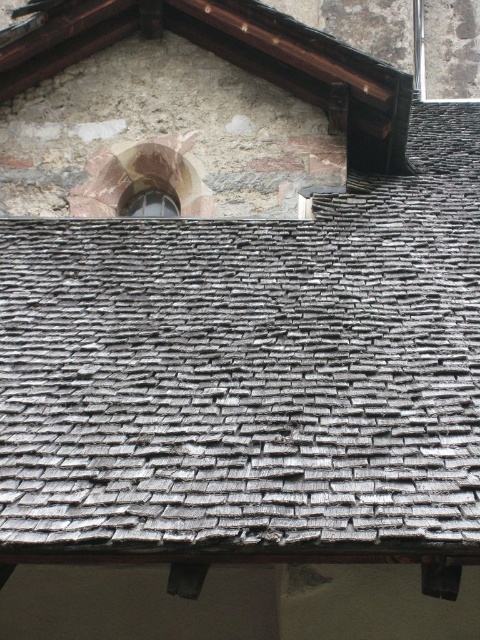
How far apart are weathered wood shingles at upper center and matte glass window at upper center?

The distance of weathered wood shingles at upper center from matte glass window at upper center is 22.61 feet.

Is point (238, 234) positioned in front of point (167, 195)?

Yes, it is.

The width and height of the screenshot is (480, 640). Find the location of `weathered wood shingles at upper center`. weathered wood shingles at upper center is located at coordinates pos(252,372).